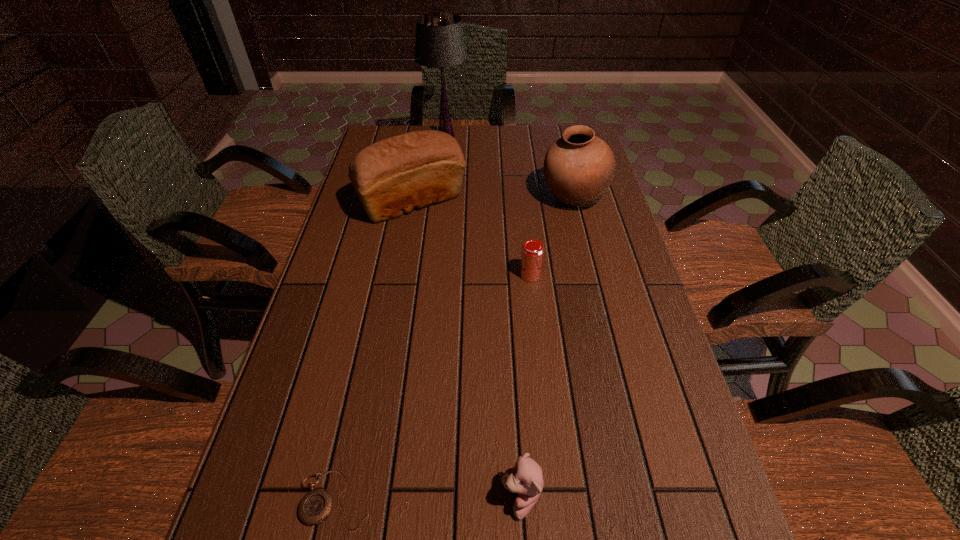
Identify the location of object that can be found as the fourth closest to the fourth farthest object. (315, 507).

Locate an element on the screen. Image resolution: width=960 pixels, height=540 pixels. vacant space that satisfies the following two spatial constraints: 1. on the front side of the third nearest object; 2. at the face of the teddy bear is located at coordinates (555, 498).

You are a GUI agent. You are given a task and a screenshot of the screen. Output one action in this format:
    pyautogui.click(x=<x>, y=<y>)
    Task: Click on the vacant region that satisfies the following two spatial constraints: 1. on the back side of the bread; 2. on the left side of the pottery
    This screenshot has width=960, height=540.
    Given the screenshot: What is the action you would take?
    pyautogui.click(x=413, y=198)